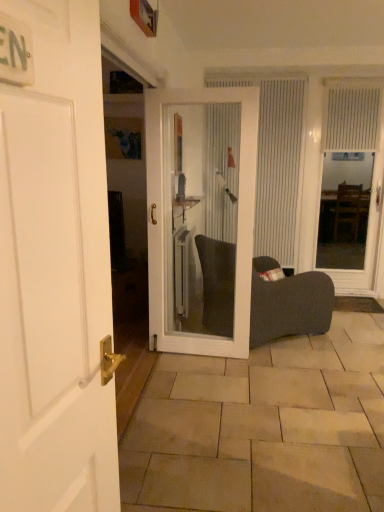
I want to click on free location in front of white glossy door at center, which appears as the second door when viewed from the front, so click(x=202, y=380).